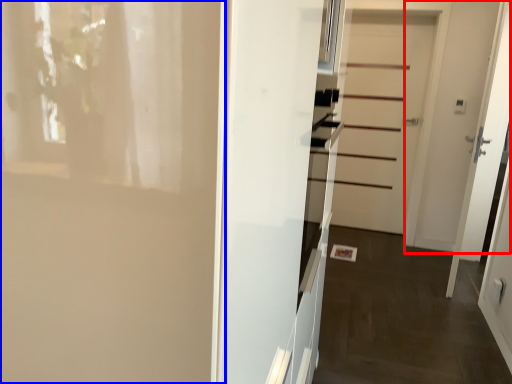
Question: Among these objects, which one is nearest to the camera, door (highlighted by a red box) or door (highlighted by a blue box)?

Choices:
 (A) door
 (B) door

Answer: (B)